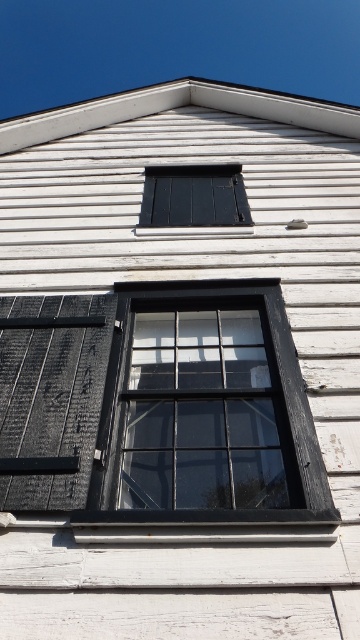
Question: Which of the following is the farthest from the observer?

Choices:
 (A) tap(146, 221)
 (B) tap(92, 408)

Answer: (A)

Question: Is black wood shutter at left thinner than matte black window at center?

Choices:
 (A) yes
 (B) no

Answer: (A)

Question: Which of the following is the closest to the observer?

Choices:
 (A) (36, 330)
 (B) (190, 173)

Answer: (A)

Question: Among these objects, which one is farthest from the camera?

Choices:
 (A) matte black window at center
 (B) black wood shutter at left

Answer: (A)

Question: Can you confirm if black wood shutter at left is wider than matte black window at center?

Choices:
 (A) no
 (B) yes

Answer: (A)

Question: Is black wood shutter at left wider than matte black window at center?

Choices:
 (A) no
 (B) yes

Answer: (A)